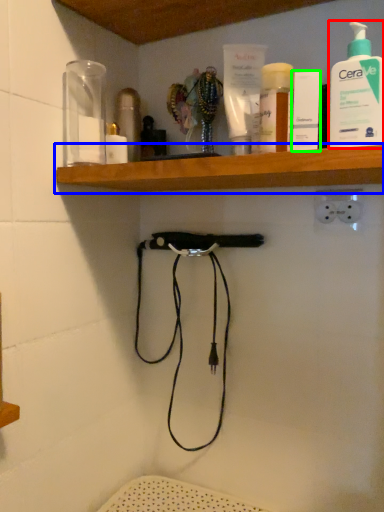
Question: Based on their relative distances, which object is nearer to cleaning product (highlighted by a red box)? Choose from shelf (highlighted by a blue box) and toiletry (highlighted by a green box).

Choices:
 (A) shelf
 (B) toiletry

Answer: (B)